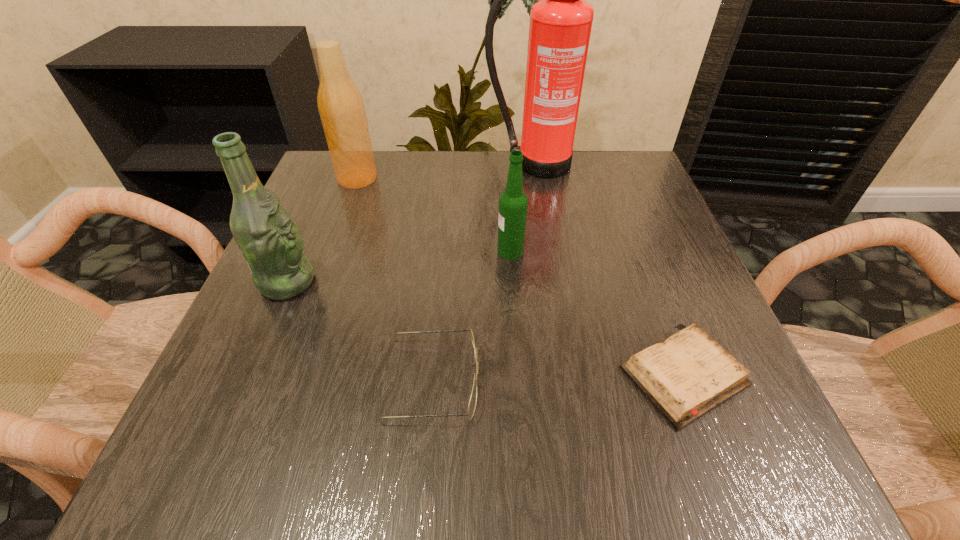
In the image, there is a desktop. At what (x,y) coordinates should I click in order to perform the action: click on vacant space at the near left corner. Please return your answer as a coordinate pair (x, y). Looking at the image, I should click on (198, 465).

Where is `free point at the far right corner`? free point at the far right corner is located at coordinates (596, 165).

This screenshot has height=540, width=960. I want to click on vacant space that's between the fifth tallest object and the tallest object, so click(483, 272).

Find the location of a particular element. vacant space that's between the rightmost beer bottle and the fourth object from right to left is located at coordinates (471, 315).

This screenshot has width=960, height=540. Find the location of `free space between the third object from left to right and the fire extinguisher`. free space between the third object from left to right and the fire extinguisher is located at coordinates (483, 272).

Locate an element on the screen. The height and width of the screenshot is (540, 960). free space between the third nearest object and the farthest beer bottle is located at coordinates (323, 230).

Locate an element on the screen. free space between the farthest beer bottle and the diary is located at coordinates (520, 278).

Locate an element on the screen. blank region between the tallest object and the farthest beer bottle is located at coordinates (444, 172).

In order to click on vacant region between the spectacles and the third farthest object in this screenshot , I will do `click(471, 315)`.

You are a GUI agent. You are given a task and a screenshot of the screen. Output one action in this format:
    pyautogui.click(x=<x>, y=<y>)
    Task: Click on the vacant area that lies between the tallest object and the fifth tallest object
    The height and width of the screenshot is (540, 960).
    Given the screenshot: What is the action you would take?
    pyautogui.click(x=483, y=272)